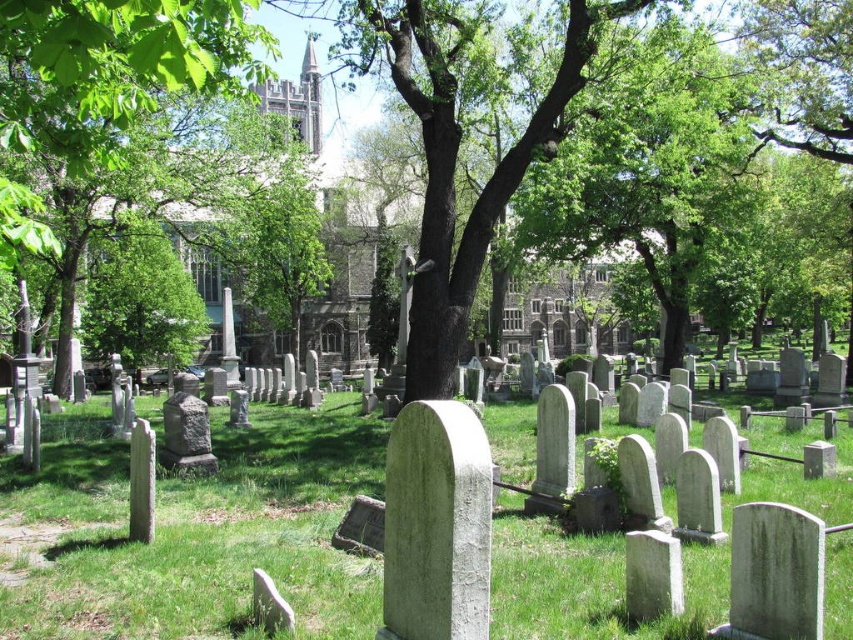
You are standing at the entrance of the cemetery and want to walk towards the two points marked in the image. Which point, point (695, 440) or point (103, 88), will you reach first?

You will reach point (103, 88) first because it is closer to you than point (695, 440), which is further away.